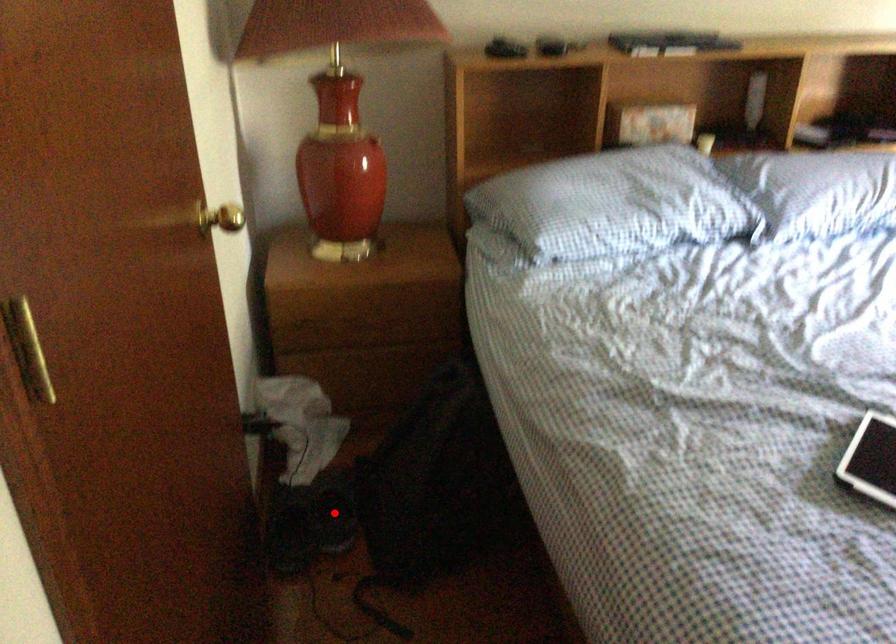
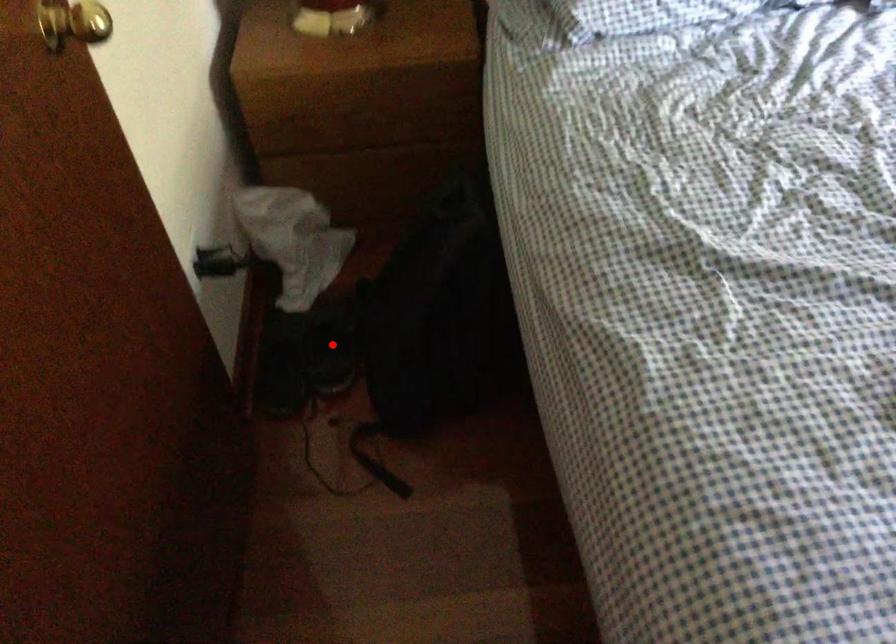
I am providing you with two images of the same scene from different viewpoints. A red point is marked on the first image and another point is marked on the second image. Is the marked point in image1 the same physical position as the marked point in image2?

Yes